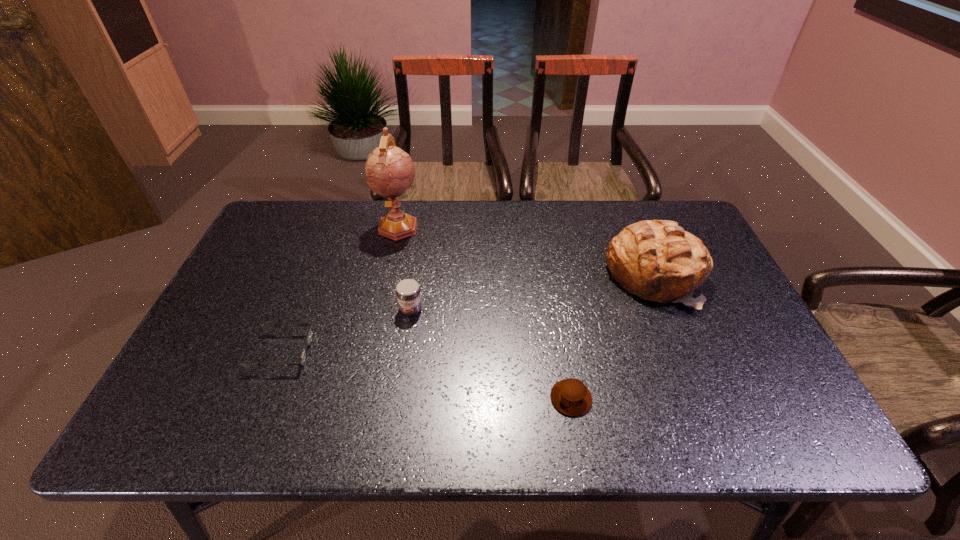
Find the location of `free space at the near edge of the desktop`. free space at the near edge of the desktop is located at coordinates (466, 431).

Identify the location of free space at the left edge of the desktop. (222, 340).

You are a GUI agent. You are given a task and a screenshot of the screen. Output one action in this format:
    pyautogui.click(x=<x>, y=<y>)
    Task: Click on the vacant space at the right edge of the desktop
    The image size is (960, 540).
    Given the screenshot: What is the action you would take?
    pyautogui.click(x=732, y=289)

Where is `free region at the far left corner of the desktop`? The image size is (960, 540). free region at the far left corner of the desktop is located at coordinates (307, 202).

The image size is (960, 540). What are the coordinates of `vacant space at the far right corner` in the screenshot? It's located at (648, 210).

Locate an element on the screen. The image size is (960, 540). empty space between the globe and the third shortest object is located at coordinates (405, 268).

Find the location of a particular element. empty space that is in between the muffin and the rightmost object is located at coordinates (612, 337).

Identify the location of empty space that is in between the globe and the muffin. This screenshot has height=540, width=960. (485, 312).

You are a GUI agent. You are given a task and a screenshot of the screen. Output one action in this format:
    pyautogui.click(x=<x>, y=<y>)
    Task: Click on the vacant space that's between the shortest object and the third tallest object
    The height and width of the screenshot is (540, 960).
    Given the screenshot: What is the action you would take?
    pyautogui.click(x=348, y=330)

The width and height of the screenshot is (960, 540). I want to click on empty space that is in between the fourth shortest object and the tallest object, so click(x=526, y=251).